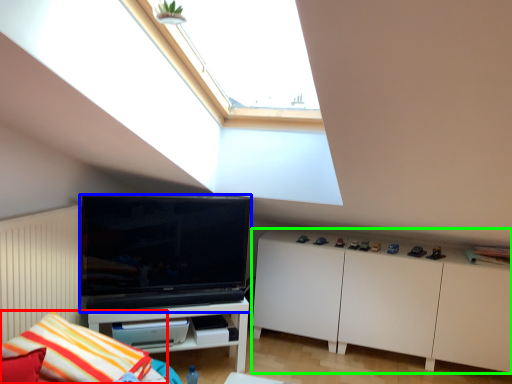
Question: Which object is positioned farthest from pillow (highlighted by a red box)? Select from television (highlighted by a blue box) and cabinetry (highlighted by a green box).

Choices:
 (A) television
 (B) cabinetry

Answer: (B)